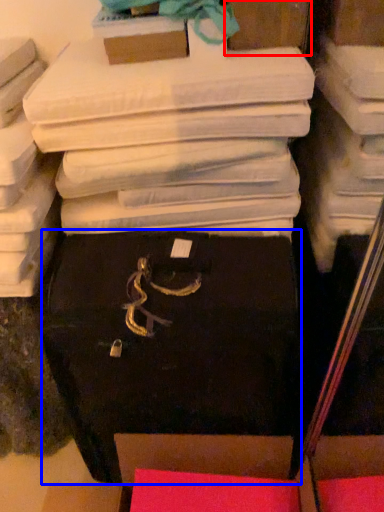
Question: Which object is closer to the camera taking this photo, storage box (highlighted by a red box) or storage box (highlighted by a blue box)?

Choices:
 (A) storage box
 (B) storage box

Answer: (B)